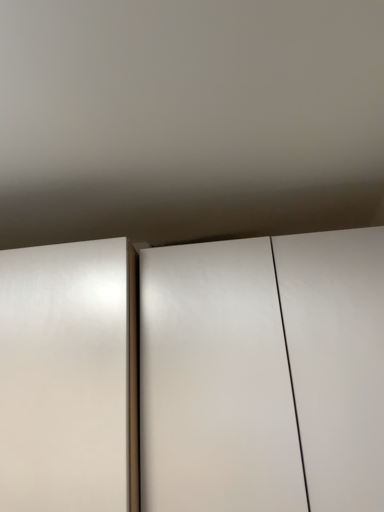
Question: Should I look upward or downward to see satin white door at left?

Choices:
 (A) down
 (B) up

Answer: (A)

Question: Does satin white door at left touch white glossy cupboard at center?

Choices:
 (A) no
 (B) yes

Answer: (A)

Question: Considering the relative positions of satin white door at left and white glossy cupboard at center in the image provided, is satin white door at left to the right of white glossy cupboard at center from the viewer's perspective?

Choices:
 (A) no
 (B) yes

Answer: (A)

Question: Is white glossy cupboard at center completely or partially inside satin white door at left?

Choices:
 (A) no
 (B) yes

Answer: (A)

Question: Does satin white door at left turn towards white glossy cupboard at center?

Choices:
 (A) yes
 (B) no

Answer: (B)

Question: Is satin white door at left positioned behind white glossy cupboard at center?

Choices:
 (A) no
 (B) yes

Answer: (A)

Question: Is satin white door at left smaller than white glossy cupboard at center?

Choices:
 (A) no
 (B) yes

Answer: (B)

Question: Does white glossy cupboard at center have a lesser height compared to satin white door at left?

Choices:
 (A) yes
 (B) no

Answer: (B)

Question: Is white glossy cupboard at center oriented towards satin white door at left?

Choices:
 (A) no
 (B) yes

Answer: (A)

Question: Does white glossy cupboard at center touch satin white door at left?

Choices:
 (A) yes
 (B) no

Answer: (B)

Question: Is the depth of white glossy cupboard at center greater than that of satin white door at left?

Choices:
 (A) yes
 (B) no

Answer: (A)

Question: Can you confirm if white glossy cupboard at center is taller than satin white door at left?

Choices:
 (A) yes
 (B) no

Answer: (A)

Question: From a real-world perspective, is white glossy cupboard at center positioned over satin white door at left based on gravity?

Choices:
 (A) no
 (B) yes

Answer: (A)

Question: Is point (114, 282) positioned closer to the camera than point (312, 418)?

Choices:
 (A) closer
 (B) farther

Answer: (B)